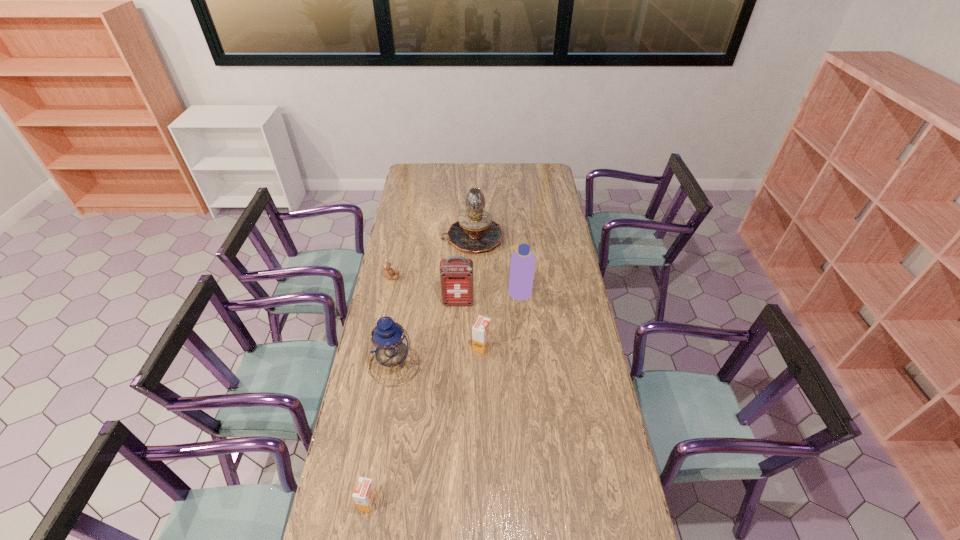
Identify the location of the sixth tallest object. (365, 494).

Identify the location of the nearer orange juice. The width and height of the screenshot is (960, 540). (365, 494).

Locate an element on the screen. The image size is (960, 540). the right orange juice is located at coordinates (481, 330).

This screenshot has height=540, width=960. Identify the location of the farther orange juice. (481, 330).

The height and width of the screenshot is (540, 960). I want to click on the first-aid kit, so click(456, 273).

This screenshot has height=540, width=960. Find the location of `lantern`. lantern is located at coordinates (389, 344).

Image resolution: width=960 pixels, height=540 pixels. In order to click on teddy bear in this screenshot , I will do `click(388, 272)`.

The height and width of the screenshot is (540, 960). Identify the location of shampoo. (522, 264).

In order to click on oil lamp in this screenshot , I will do `click(475, 231)`.

You are a GUI agent. You are given a task and a screenshot of the screen. Output one action in this format:
    pyautogui.click(x=<x>, y=<y>)
    Task: Click on the free region located 0.060m on the right of the left orange juice
    This screenshot has width=960, height=540.
    Given the screenshot: What is the action you would take?
    point(396,502)